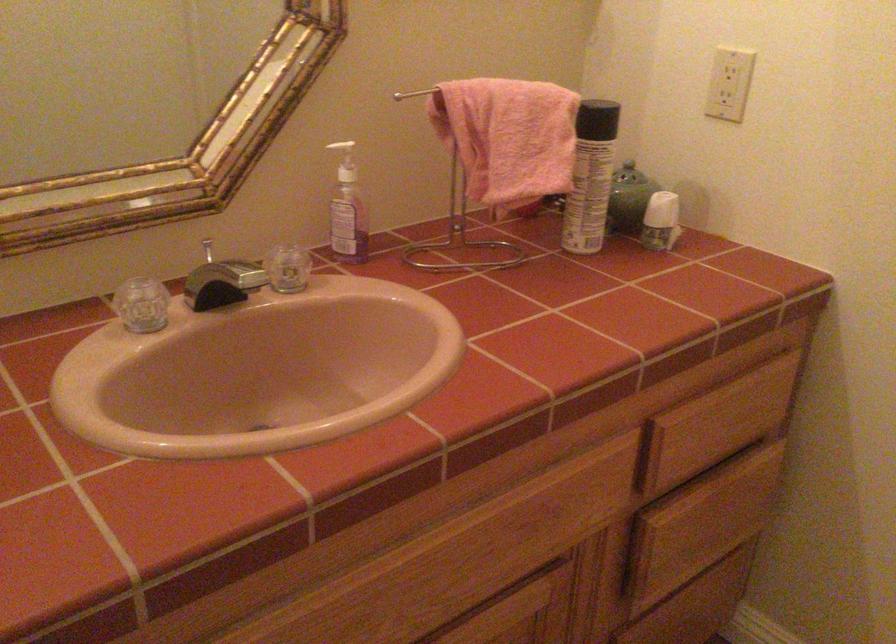
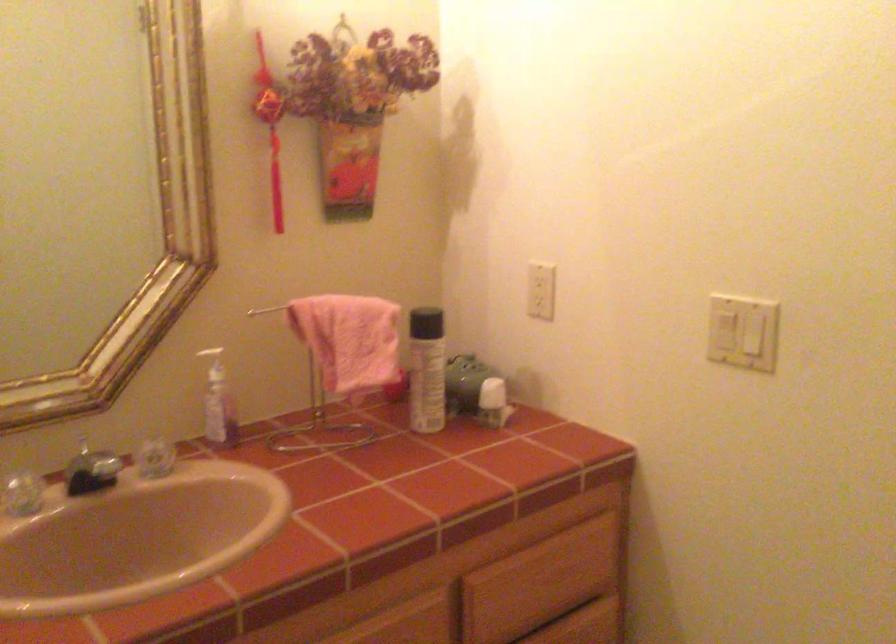
In a continuous first-person perspective shot, in which direction is the camera moving?

The movement direction of the cameraman is right, backward.